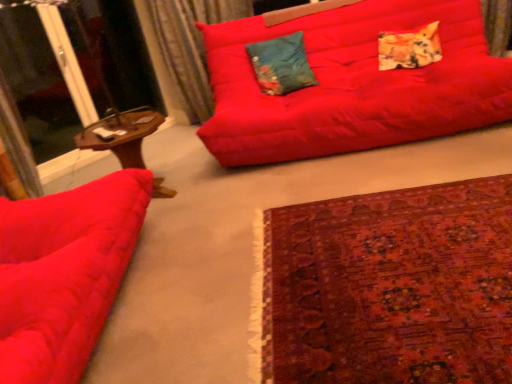
The image size is (512, 384). Identify the location of empty space that is in between matte red studio couch at left, acting as the first studio couch starting from the left, and carpet with intricate patterns at lower right. (214, 278).